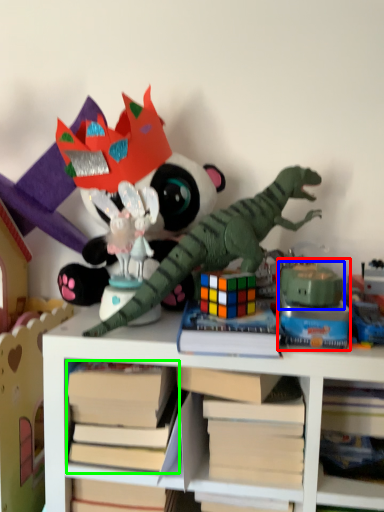
Question: Which object is positioned farthest from toy (highlighted by a red box)? Select from toy (highlighted by a blue box) and book (highlighted by a green box).

Choices:
 (A) toy
 (B) book

Answer: (B)